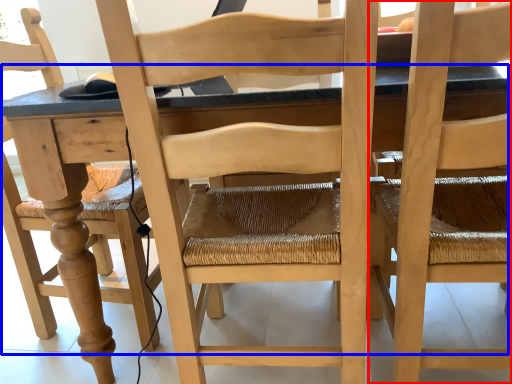
Question: Which object is further to the camera taking this photo, chair (highlighted by a red box) or table (highlighted by a blue box)?

Choices:
 (A) chair
 (B) table

Answer: (B)